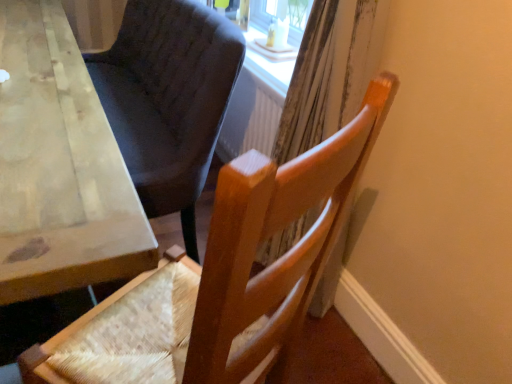
The height and width of the screenshot is (384, 512). I want to click on wooden table at left, so click(x=59, y=166).

From the picture: Looking at their sizes, would you say wooden curtain at right is wider or thinner than wooden chair at center?

Considering their sizes, wooden curtain at right looks slimmer than wooden chair at center.

At what (x,y) coordinates should I click in order to perform the action: click on curtain behind the wooden chair at center. Please return your answer as a coordinate pair (x, y). The width and height of the screenshot is (512, 384). Looking at the image, I should click on point(329,73).

Is wooden curtain at right touching wooden chair at center?

No, wooden curtain at right is not in contact with wooden chair at center.

Is wooden curtain at right closer to the viewer compared to wooden chair at center?

No.

Identify the location of chair on the right of the wooden table at left. The width and height of the screenshot is (512, 384). (281, 257).

Is wooden table at left at the back of wooden chair at center?

No, wooden chair at center is not facing the opposite direction of wooden table at left.

You are a GUI agent. You are given a task and a screenshot of the screen. Output one action in this format:
    pyautogui.click(x=<x>, y=<y>)
    Task: Click on the table below the wooden chair at center (from a real-world perspective)
    This screenshot has height=384, width=512.
    Given the screenshot: What is the action you would take?
    pyautogui.click(x=59, y=166)

In the scene shown: Is wooden table at left wider than wooden chair at center?

Incorrect, the width of wooden table at left does not surpass that of wooden chair at center.

Is wooden table at left positioned far away from wooden chair at center?

No, wooden table at left is not far from wooden chair at center.

Is wooden table at left smaller than wooden curtain at right?

Incorrect, wooden table at left is not smaller in size than wooden curtain at right.

Does point (136, 244) appear closer or farther from the camera than point (297, 96)?

Clearly, point (136, 244) is closer to the camera than point (297, 96).

Between wooden table at left and wooden curtain at right, which one has larger width?

wooden table at left.

Is wooden curtain at right located within wooden chair at center?

No, wooden curtain at right is not inside wooden chair at center.

Considering the positions of objects wooden chair at center and wooden curtain at right in the image provided, who is in front, wooden chair at center or wooden curtain at right?

wooden chair at center is closer to the camera.

Are wooden chair at center and wooden curtain at right far apart?

They are positioned close to each other.

What's the angular difference between wooden chair at center and wooden curtain at right's facing directions?

They differ by 62.6 degrees in their facing directions.

Find the location of `table on the left of wooden curtain at right`. table on the left of wooden curtain at right is located at coordinates [x=59, y=166].

Which point is more forward, (294,134) or (74,79)?

Positioned in front is point (74,79).

Which of these two, wooden curtain at right or wooden table at left, stands shorter?

Standing shorter between the two is wooden table at left.

Considering the sizes of objects wooden curtain at right and wooden table at left in the image provided, who is wider, wooden curtain at right or wooden table at left?

With larger width is wooden table at left.

The width and height of the screenshot is (512, 384). In order to click on curtain behind the wooden chair at center in this screenshot , I will do `click(329, 73)`.

Where is `table located underneath the wooden chair at center (from a real-world perspective)`? This screenshot has width=512, height=384. table located underneath the wooden chair at center (from a real-world perspective) is located at coordinates (59, 166).

Looking at the image, which one is located closer to wooden table at left, wooden chair at center or wooden curtain at right?

Among the two, wooden chair at center is located nearer to wooden table at left.

Estimate the real-world distances between objects in this image. Which object is further from wooden table at left, wooden curtain at right or wooden chair at center?

Based on the image, wooden curtain at right appears to be further to wooden table at left.

Estimate the real-world distances between objects in this image. Which object is closer to wooden curtain at right, wooden chair at center or wooden table at left?

wooden chair at center is positioned closer to the anchor wooden curtain at right.

Which object lies nearer to the anchor point wooden chair at center, wooden table at left or wooden curtain at right?

wooden table at left.

Which object lies further to the anchor point wooden curtain at right, wooden table at left or wooden chair at center?

wooden table at left is positioned further to the anchor wooden curtain at right.

Which object lies further to the anchor point wooden chair at center, wooden curtain at right or wooden table at left?

Based on the image, wooden curtain at right appears to be further to wooden chair at center.

In order to click on chair between wooden table at left and wooden curtain at right in the horizontal direction in this screenshot , I will do `click(281, 257)`.